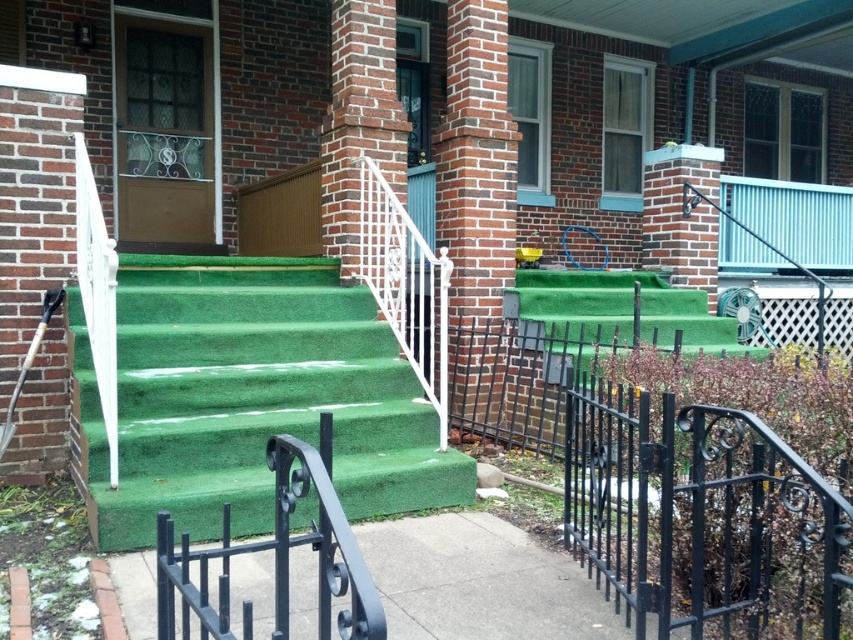
Question: Based on their relative distances, which object is nearer to the green artificial turf at center?

Choices:
 (A) black wrought iron at center
 (B) black wrought iron railing at lower right

Answer: (A)

Question: Can you confirm if green artificial turf at center is positioned to the left of black wrought iron railing at lower right?

Choices:
 (A) no
 (B) yes

Answer: (B)

Question: Considering the real-world distances, which object is farthest from the black wrought iron railing at lower right?

Choices:
 (A) green artificial turf at center
 (B) black wrought iron at center

Answer: (A)

Question: Which point is closer to the camera taking this photo?

Choices:
 (A) 628,588
 (B) 155,547

Answer: (A)

Question: From the image, what is the correct spatial relationship of black wrought iron railing at lower right in relation to black wrought iron at center?

Choices:
 (A) right
 (B) left

Answer: (A)

Question: Can you confirm if green artificial turf at center is positioned to the left of black wrought iron railing at lower right?

Choices:
 (A) no
 (B) yes

Answer: (B)